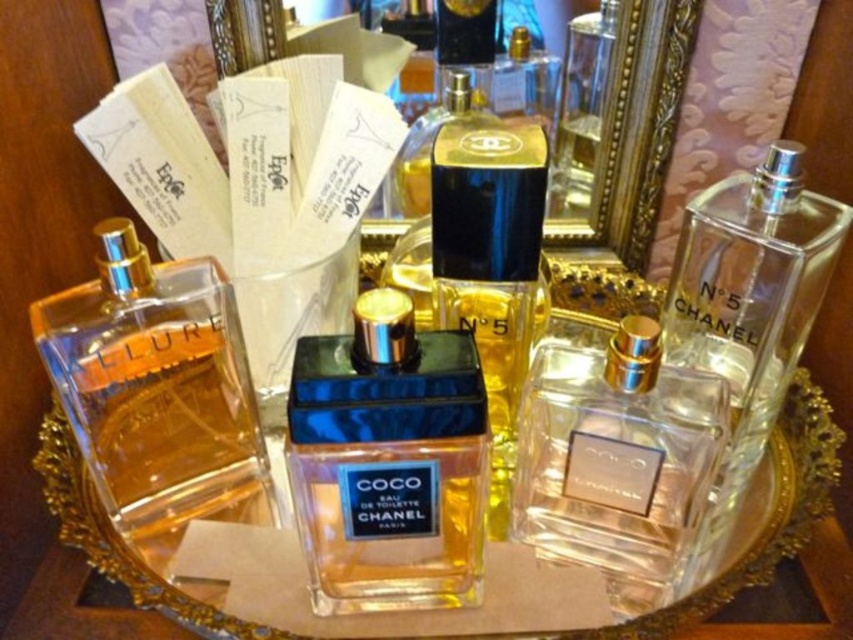
Between clear glass bottle at left and clear glass perfume at center, which one appears on the right side from the viewer's perspective?

clear glass perfume at center

Based on the photo, can you confirm if clear glass bottle at left is positioned below clear glass perfume at center?

No, clear glass bottle at left is not below clear glass perfume at center.

Where is `clear glass bottle at left`? The width and height of the screenshot is (853, 640). clear glass bottle at left is located at coordinates 154,385.

I want to click on clear glass bottle at left, so click(154, 385).

How much distance is there between shiny blue glass perfume at center and clear glass bottle at left?

shiny blue glass perfume at center and clear glass bottle at left are 5.78 inches apart.

Which is more to the right, shiny blue glass perfume at center or clear glass bottle at left?

shiny blue glass perfume at center is more to the right.

Between point (334, 396) and point (148, 253), which one is positioned behind?

Point (148, 253)

The image size is (853, 640). I want to click on shiny blue glass perfume at center, so click(x=387, y=461).

Based on the photo, can you confirm if shiny blue glass perfume at center is taller than clear glass perfume at center?

Yes.

Which is more to the right, shiny blue glass perfume at center or clear glass perfume at center?

Positioned to the right is clear glass perfume at center.

This screenshot has height=640, width=853. I want to click on shiny blue glass perfume at center, so click(387, 461).